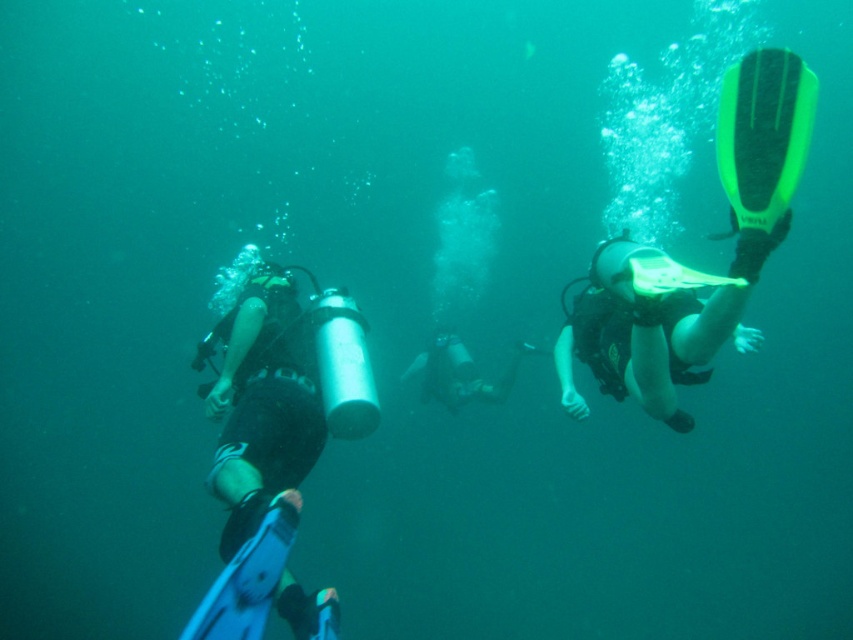
This screenshot has height=640, width=853. What do you see at coordinates (654, 321) in the screenshot? I see `neon yellow rubber fin at right` at bounding box center [654, 321].

Between neon yellow rubber fin at right and black matte wetsuit at center, which one is positioned higher?

neon yellow rubber fin at right is higher up.

Between point (654, 324) and point (502, 392), which one is positioned behind?

Point (502, 392)

Identify the location of neon yellow rubber fin at right. (654, 321).

Does black matte wetsuit at left have a larger size compared to black matte wetsuit at center?

Correct, black matte wetsuit at left is larger in size than black matte wetsuit at center.

What do you see at coordinates (260, 403) in the screenshot? I see `black matte wetsuit at left` at bounding box center [260, 403].

The width and height of the screenshot is (853, 640). I want to click on black matte wetsuit at left, so click(x=260, y=403).

Is black matte wetsuit at left wider than neon yellow rubber fin at right?

Yes, black matte wetsuit at left is wider than neon yellow rubber fin at right.

Is point (212, 403) positioned before point (614, 264)?

Yes.

Is point (281, 428) closer to camera compared to point (631, 246)?

Yes.

The height and width of the screenshot is (640, 853). Identify the location of black matte wetsuit at left. (260, 403).